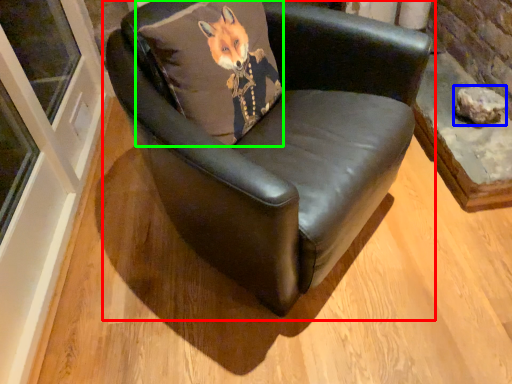
Question: Based on their relative distances, which object is farther from chair (highlighted by a red box)? Choose from stone (highlighted by a blue box) and pillow (highlighted by a green box).

Choices:
 (A) stone
 (B) pillow

Answer: (A)